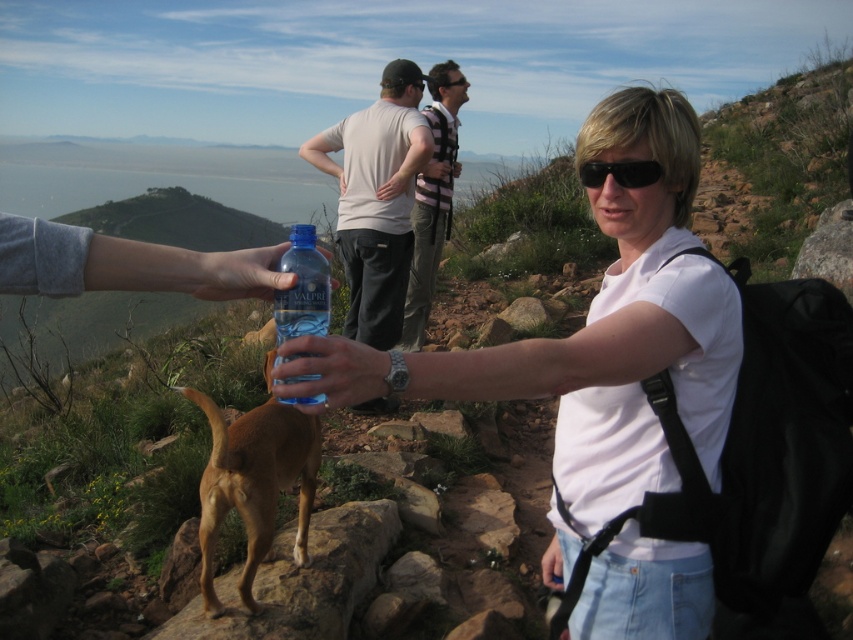
Question: Can you confirm if brown furry dog at lower left is positioned to the right of blue plastic bottle at center?

Choices:
 (A) no
 (B) yes

Answer: (A)

Question: Is light gray cotton t-shirt at upper center to the right of brown furry dog at lower left from the viewer's perspective?

Choices:
 (A) yes
 (B) no

Answer: (A)

Question: Which point is farther to the camera?

Choices:
 (A) (413, 188)
 (B) (265, 451)

Answer: (A)

Question: Which is farther from the striped shirt at center?

Choices:
 (A) black matte sunglasses at center
 (B) light gray cotton t-shirt at upper center
 (C) black plastic sunglasses at upper center

Answer: (A)

Question: Which point is farther to the camera?

Choices:
 (A) white matte shirt at center
 (B) striped shirt at center
 (C) black matte sunglasses at center

Answer: (B)

Question: Does white matte shirt at center have a smaller size compared to blue plastic bottle at center?

Choices:
 (A) no
 (B) yes

Answer: (A)